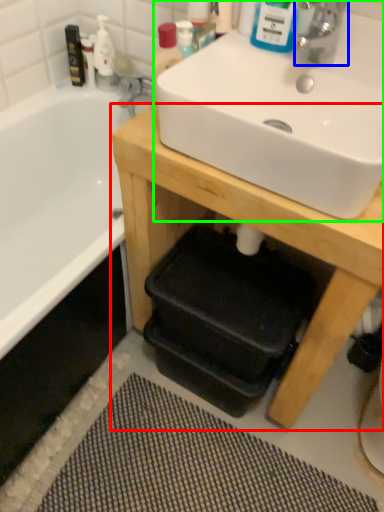
Question: Considering the real-world distances, which object is farthest from table (highlighted by a red box)? tap (highlighted by a blue box) or sink (highlighted by a green box)?

Choices:
 (A) tap
 (B) sink

Answer: (A)